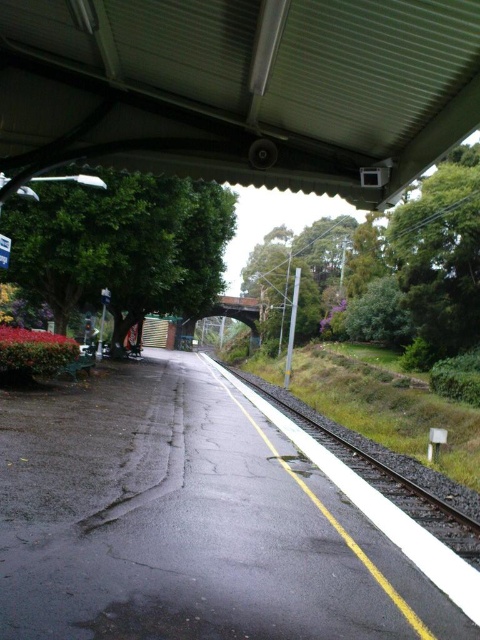
Question: Which point is farther to the camera?

Choices:
 (A) green corrugated metal canopy at upper center
 (B) black asphalt train track at lower right

Answer: (B)

Question: Among these objects, which one is nearest to the camera?

Choices:
 (A) black asphalt train track at lower right
 (B) green corrugated metal canopy at upper center

Answer: (B)

Question: Can you confirm if green corrugated metal canopy at upper center is positioned below black asphalt train track at lower right?

Choices:
 (A) yes
 (B) no

Answer: (B)

Question: Is green corrugated metal canopy at upper center to the right of black asphalt train track at lower right from the viewer's perspective?

Choices:
 (A) yes
 (B) no

Answer: (B)

Question: Does green corrugated metal canopy at upper center lie behind black asphalt train track at lower right?

Choices:
 (A) yes
 (B) no

Answer: (B)